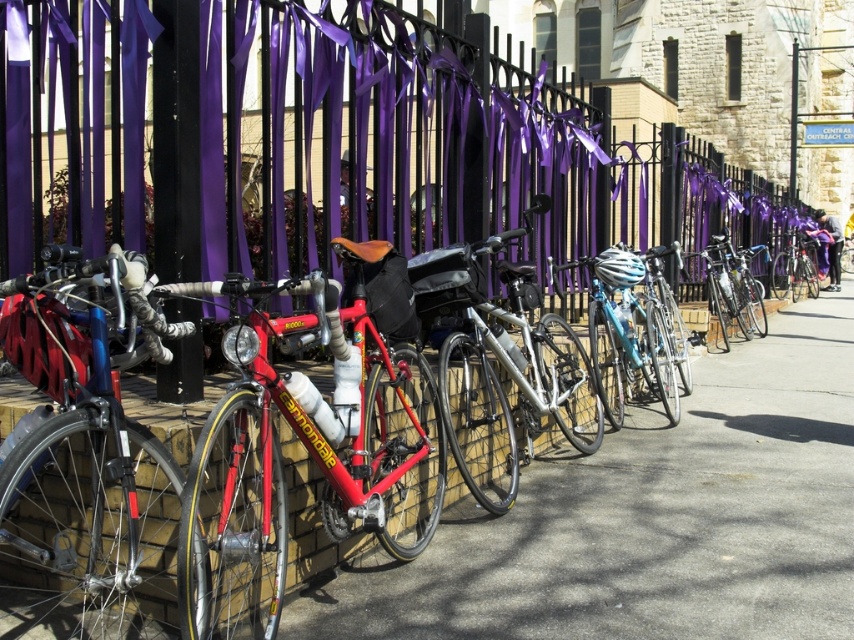
Can you confirm if shiny red bike at center is taller than shiny blue bicycle at left?

Yes.

Which is more to the right, shiny red bike at center or shiny blue bicycle at left?

shiny red bike at center

Who is more forward, (237,417) or (38,480)?

Point (237,417) is in front.

This screenshot has width=854, height=640. Find the location of `shiny red bike at center`. shiny red bike at center is located at coordinates (309, 444).

Can you confirm if smooth concrete pavement at center is shorter than silver metallic bicycle at center?

Indeed, smooth concrete pavement at center has a lesser height compared to silver metallic bicycle at center.

Can you confirm if smooth concrete pavement at center is thinner than silver metallic bicycle at center?

In fact, smooth concrete pavement at center might be wider than silver metallic bicycle at center.

Is point (685, 552) positioned in front of point (550, 202)?

Yes, point (685, 552) is in front of point (550, 202).

Locate an element on the screen. smooth concrete pavement at center is located at coordinates (651, 518).

Is smooth concrete pavement at center behind shiny blue bicycle at center?

No, smooth concrete pavement at center is closer to the viewer.

Describe the element at coordinates (651, 518) in the screenshot. I see `smooth concrete pavement at center` at that location.

Does point (536, 573) come in front of point (594, 288)?

Yes, point (536, 573) is closer to viewer.

At what (x,y) coordinates should I click in order to perform the action: click on smooth concrete pavement at center. Please return your answer as a coordinate pair (x, y). Looking at the image, I should click on (651, 518).